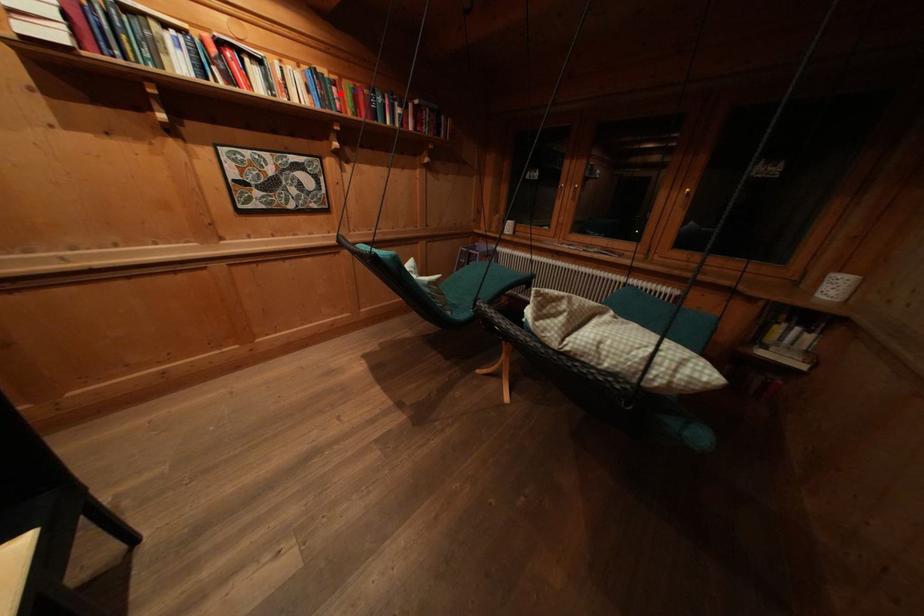
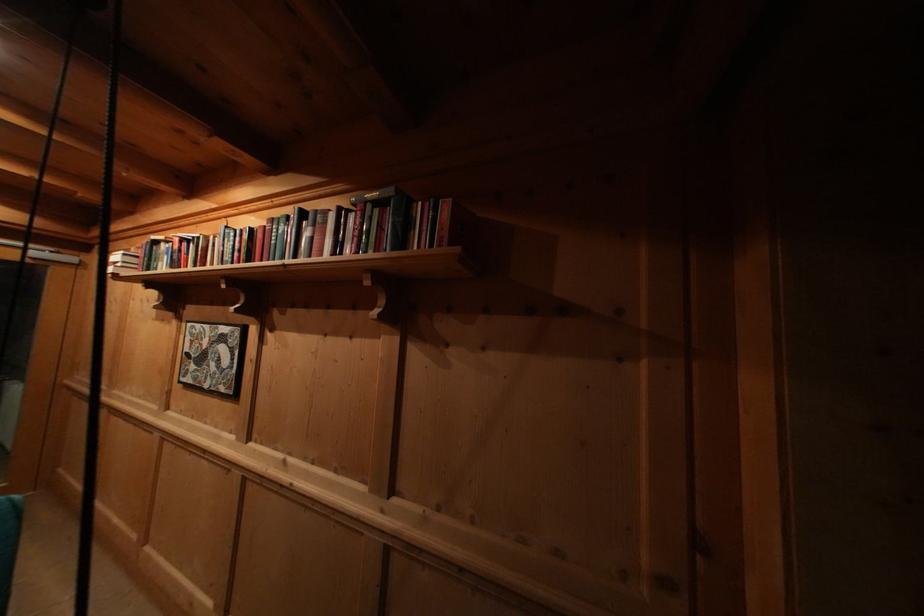
Where in the second image is the point corresponding to the highlighted location from the first image?

(244, 245)